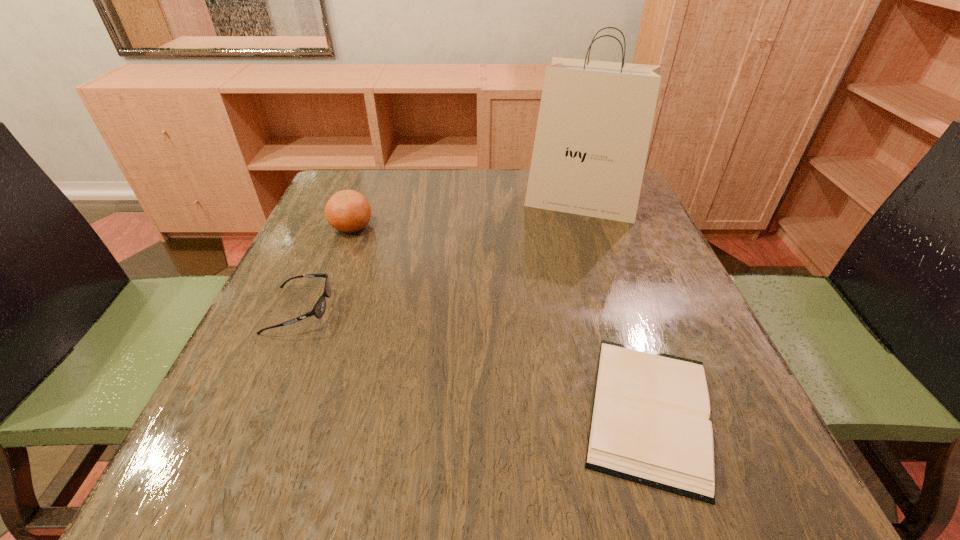
Find the location of a particular element. free space between the hardback book and the third tallest object is located at coordinates (474, 360).

At what (x,y) coordinates should I click in order to perform the action: click on free space between the tallest object and the second shortest object. Please return your answer as a coordinate pair (x, y). The image size is (960, 540). Looking at the image, I should click on (441, 256).

You are a GUI agent. You are given a task and a screenshot of the screen. Output one action in this format:
    pyautogui.click(x=<x>, y=<y>)
    Task: Click on the free area in between the hardback book and the second tallest object
    
    Given the screenshot: What is the action you would take?
    pyautogui.click(x=500, y=319)

In order to click on free point between the shopping bag and the third farthest object in this screenshot , I will do `click(441, 256)`.

Locate an element on the screen. blank region between the third tallest object and the hardback book is located at coordinates (474, 360).

The height and width of the screenshot is (540, 960). What are the coordinates of `free space between the clementine and the tallest object` in the screenshot? It's located at (467, 214).

Locate an element on the screen. This screenshot has width=960, height=540. object that ranks as the closest to the sunglasses is located at coordinates (349, 211).

Select which object is the closest to the second tallest object. Please provide its 2D coordinates. Your answer should be formatted as a tuple, i.e. [(x, y)], where the tuple contains the x and y coordinates of a point satisfying the conditions above.

[(318, 310)]

I want to click on vacant space that satisfies the following two spatial constraints: 1. on the front-facing side of the second shortest object; 2. on the left side of the nearest object, so click(256, 410).

The height and width of the screenshot is (540, 960). I want to click on vacant space that satisfies the following two spatial constraints: 1. on the front side of the second tallest object; 2. on the front-facing side of the sunglasses, so click(x=320, y=310).